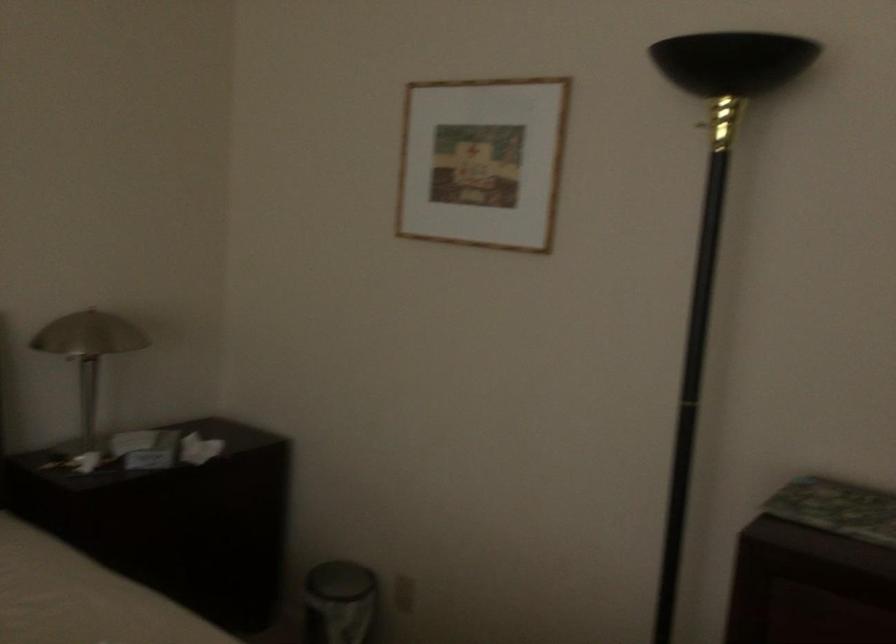
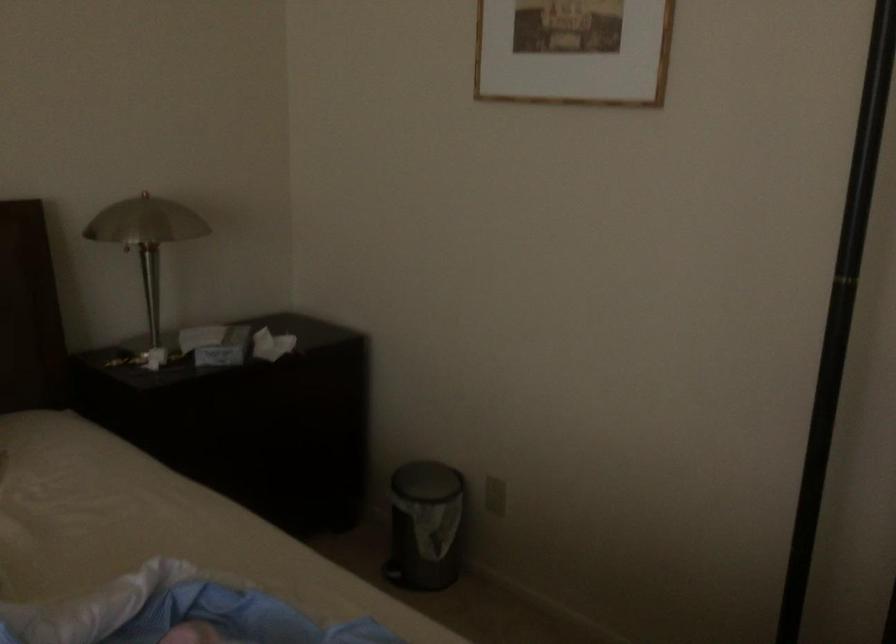
Find the pixel in the second image that matches point 88,462 in the first image.

(151, 357)